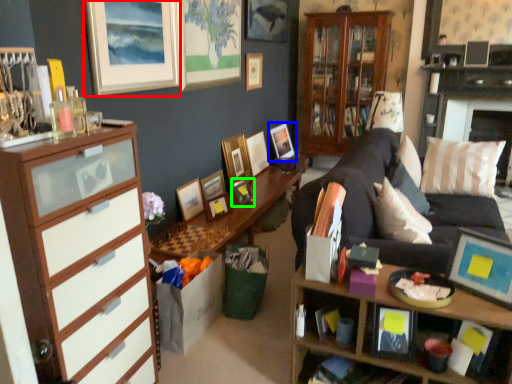
Question: Which is nearer to the picture frame (highlighted by a red box)? picture frame (highlighted by a blue box) or picture frame (highlighted by a green box).

Choices:
 (A) picture frame
 (B) picture frame

Answer: (B)